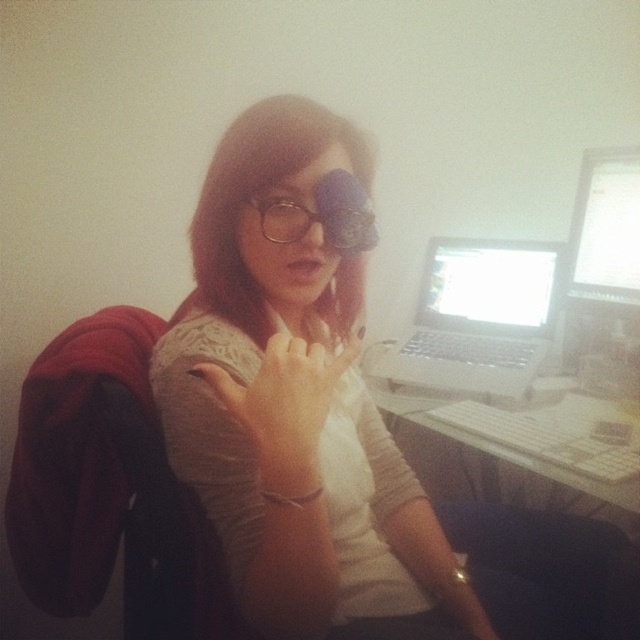
Is matte black glasses at center shorter than silver metallic laptop at center?

No, matte black glasses at center is not shorter than silver metallic laptop at center.

Is matte black glasses at center wider than silver metallic laptop at center?

Yes, matte black glasses at center is wider than silver metallic laptop at center.

Is point (611, 627) farther from camera compared to point (545, 307)?

No, (611, 627) is in front of (545, 307).

Where is `matte black glasses at center`? The width and height of the screenshot is (640, 640). matte black glasses at center is located at coordinates (339, 435).

Does point (547, 300) lie in front of point (324, 188)?

No, (547, 300) is behind (324, 188).

Image resolution: width=640 pixels, height=640 pixels. I want to click on white glossy laptop at upper right, so click(x=492, y=285).

Consider the image. Is the position of matte silver laptop at upper right less distant than that of metallic frame glasses at center?

No, matte silver laptop at upper right is behind metallic frame glasses at center.

Does matte silver laptop at upper right appear on the left side of metallic frame glasses at center?

No, matte silver laptop at upper right is not to the left of metallic frame glasses at center.

Locate an element on the screen. The width and height of the screenshot is (640, 640). matte silver laptop at upper right is located at coordinates [605, 227].

Identify the location of matte silver laptop at upper right. (605, 227).